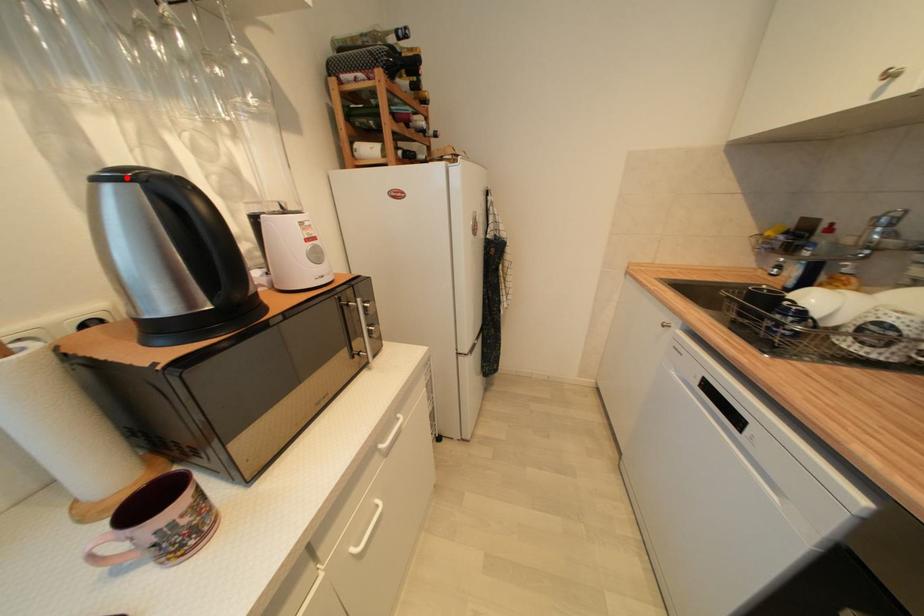
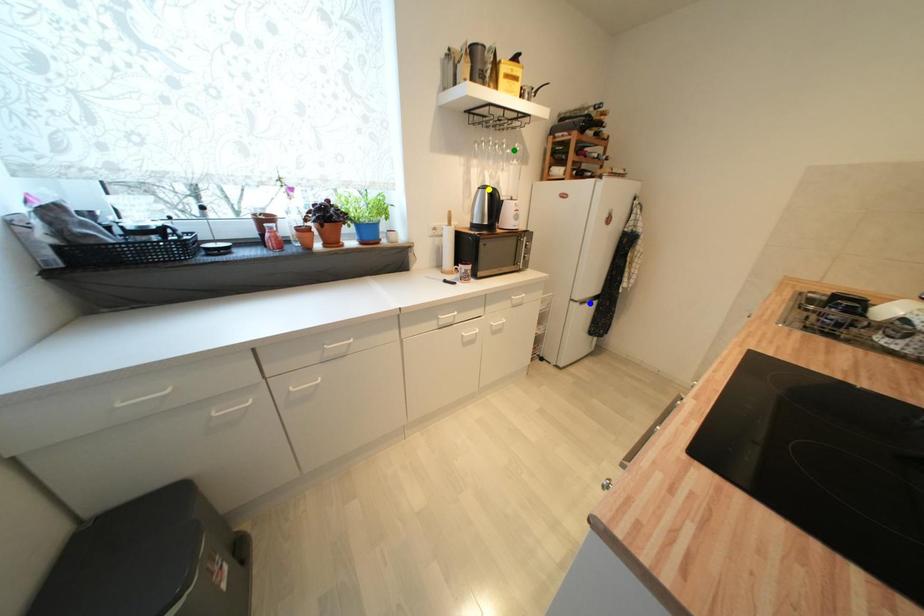
Question: I am providing you with two images of the same scene from different viewpoints. A red point is marked on the first image. You are given multiple points on the second image. In image 2, which mark is for the same physical point as the one in image 1?

Choices:
 (A) yellow point
 (B) green point
 (C) blue point

Answer: (A)